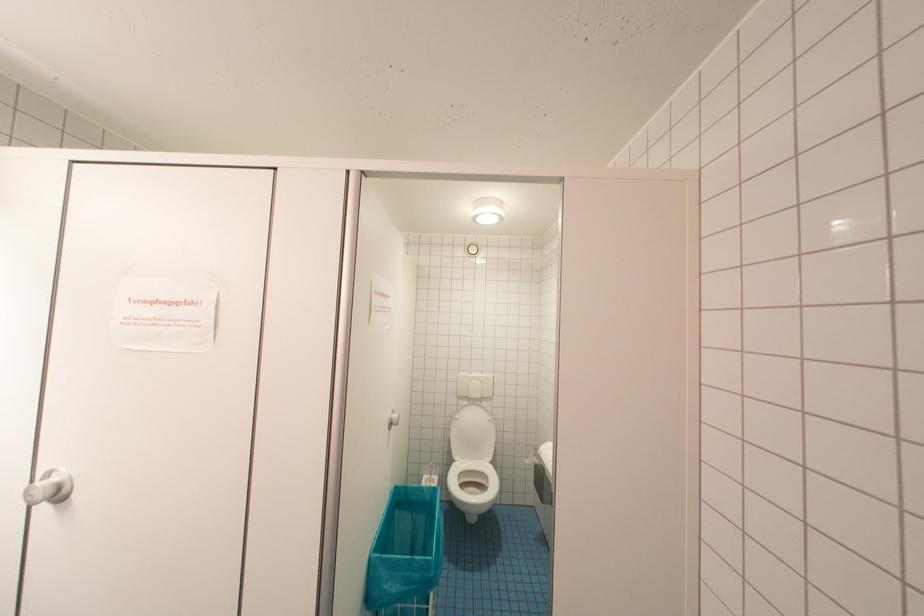
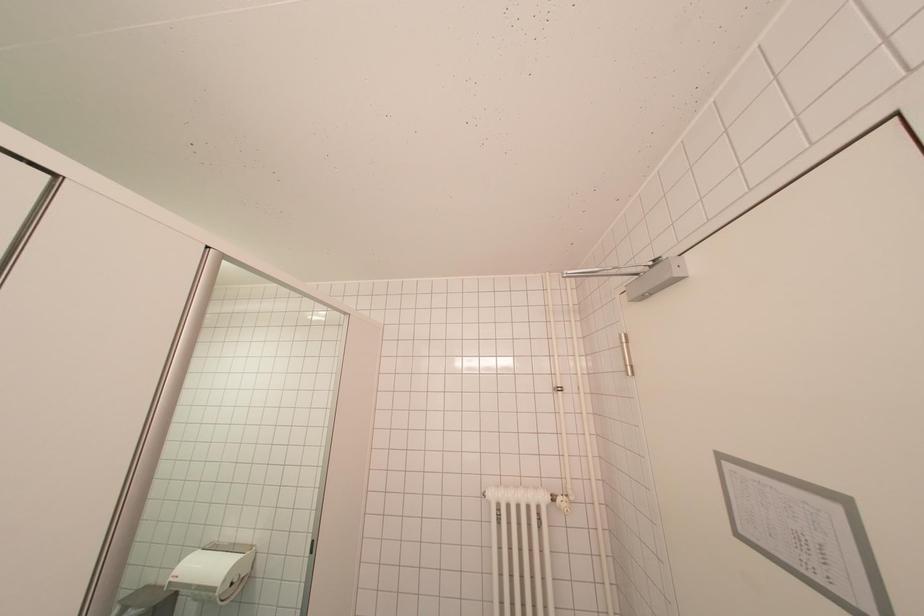
Question: Based on the continuous images, in which direction is the camera rotating? Reply with the corresponding letter.

Choices:
 (A) Left
 (B) Right
 (C) Up
 (D) Down

Answer: (B)